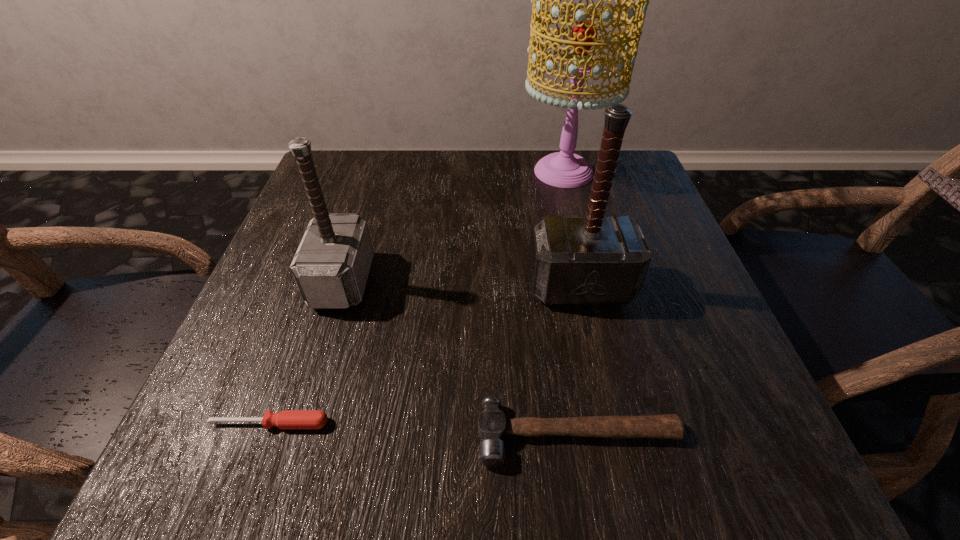
Find the location of a particular element. This screenshot has width=960, height=540. the tallest object is located at coordinates (564, 169).

Identify the location of lampshade. This screenshot has width=960, height=540. (564, 169).

The width and height of the screenshot is (960, 540). Find the location of `the fourth shortest object`. the fourth shortest object is located at coordinates (595, 259).

At what (x,y) coordinates should I click in order to perform the action: click on the third tallest object. Please return your answer as a coordinate pair (x, y). The image size is (960, 540). Looking at the image, I should click on (331, 266).

Where is `the leftmost hammer`? the leftmost hammer is located at coordinates (331, 266).

Where is `the fourth tallest object`? The height and width of the screenshot is (540, 960). the fourth tallest object is located at coordinates (492, 425).

Find the location of a particular element. the shortest hammer is located at coordinates (492, 425).

The image size is (960, 540). I want to click on the shortest object, so click(286, 419).

Locate an element on the screen. The image size is (960, 540). free space located on the front of the farthest object is located at coordinates (600, 316).

You are a GUI agent. You are given a task and a screenshot of the screen. Output one action in this format:
    pyautogui.click(x=<x>, y=<y>)
    Task: Click on the blank area located 0.220m on the left of the tallest hammer
    The height and width of the screenshot is (540, 960).
    Given the screenshot: What is the action you would take?
    pyautogui.click(x=407, y=286)